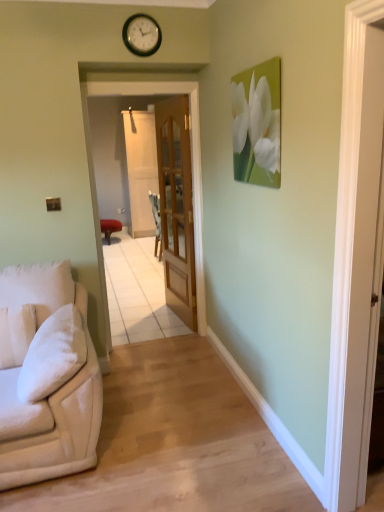
Where is `vacant area that lies in front of clear glass door at center, which is the second screen door from back to front`? vacant area that lies in front of clear glass door at center, which is the second screen door from back to front is located at coordinates (159, 362).